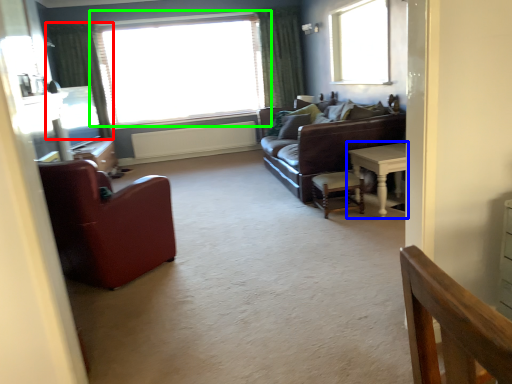
Question: Which object is the farthest from curtain (highlighted by a red box)? Choose among these: table (highlighted by a blue box) or window (highlighted by a green box).

Choices:
 (A) table
 (B) window

Answer: (A)